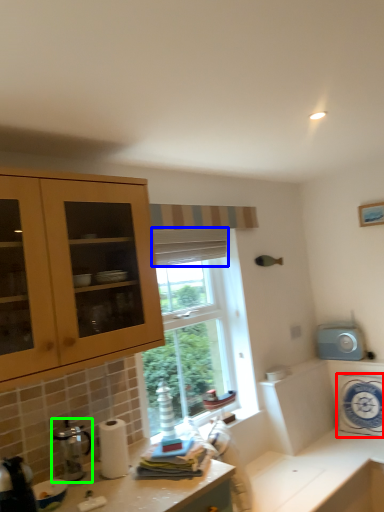
Question: Which object is the farthest from appliance (highlighted by a red box)? Choose among these: curtain (highlighted by a blue box) or coffee machine (highlighted by a green box).

Choices:
 (A) curtain
 (B) coffee machine

Answer: (B)